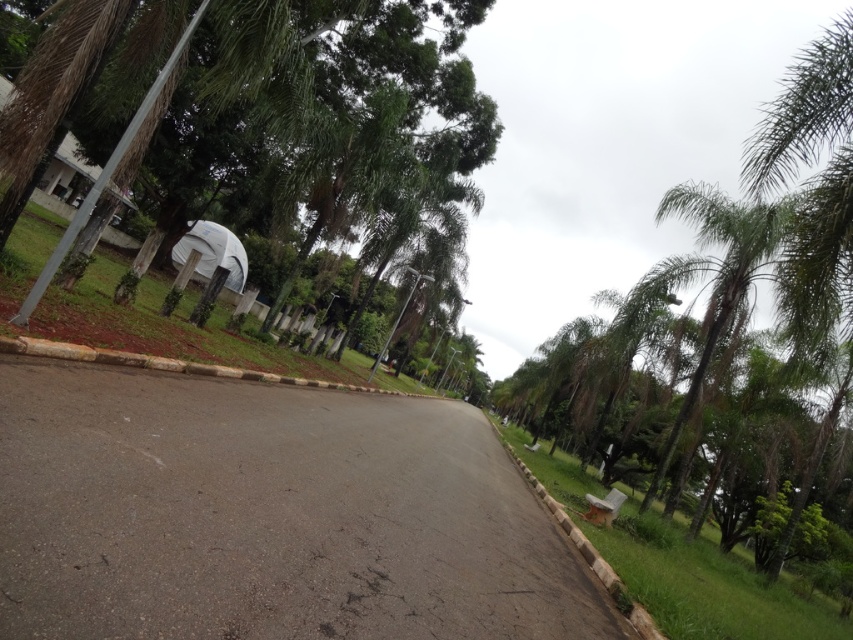
Question: Can you confirm if green leafy tree at upper left is smaller than green leafy palm tree at right?

Choices:
 (A) yes
 (B) no

Answer: (B)

Question: Which point is farther to the camera?

Choices:
 (A) green leafy tree at upper left
 (B) green leafy palm tree at right

Answer: (B)

Question: Which point appears farthest from the camera in this image?

Choices:
 (A) (712, 300)
 (B) (125, 84)

Answer: (A)

Question: Is green leafy tree at upper left closer to camera compared to green leafy palm tree at right?

Choices:
 (A) yes
 (B) no

Answer: (A)

Question: Is green leafy tree at upper left behind green leafy palm tree at right?

Choices:
 (A) no
 (B) yes

Answer: (A)